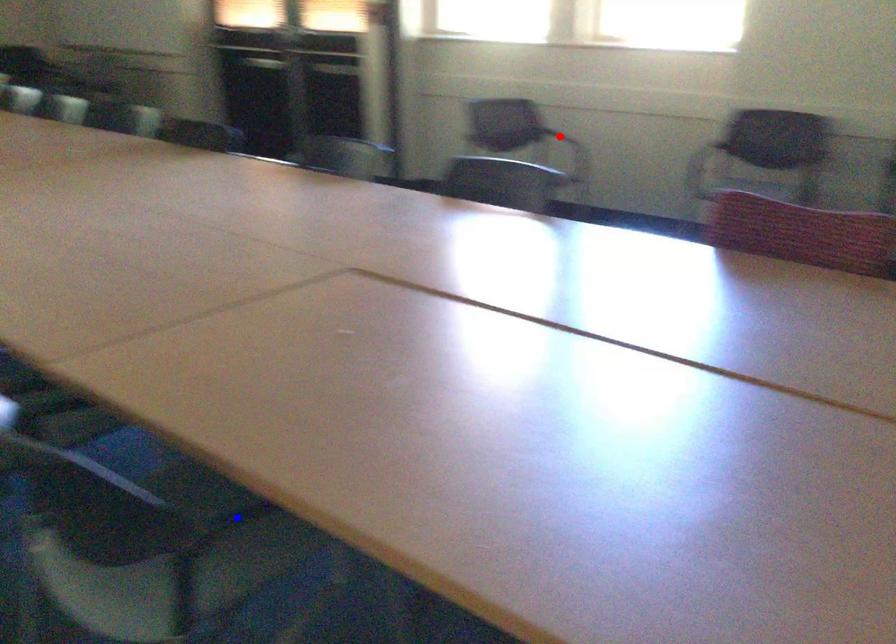
Question: In the image, two points are highlighted. Which point is nearer to the camera? Reply with the corresponding letter.

Choices:
 (A) blue point
 (B) red point

Answer: (A)